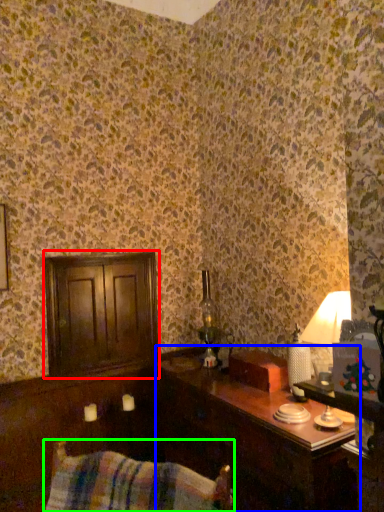
Question: Which is nearer to the dresser (highlighted by a red box)? table (highlighted by a blue box) or swivel chair (highlighted by a green box).

Choices:
 (A) table
 (B) swivel chair

Answer: (A)